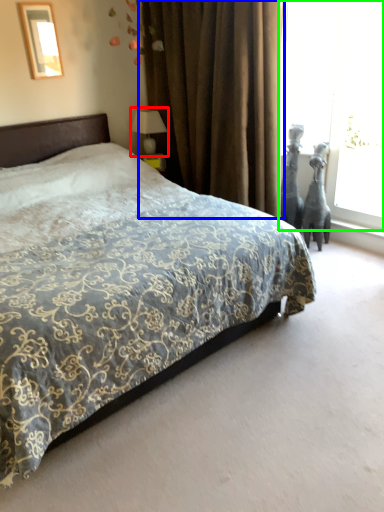
Question: Which is nearer to the table lamp (highlighted by a red box)? curtain (highlighted by a blue box) or window screen (highlighted by a green box).

Choices:
 (A) curtain
 (B) window screen

Answer: (A)